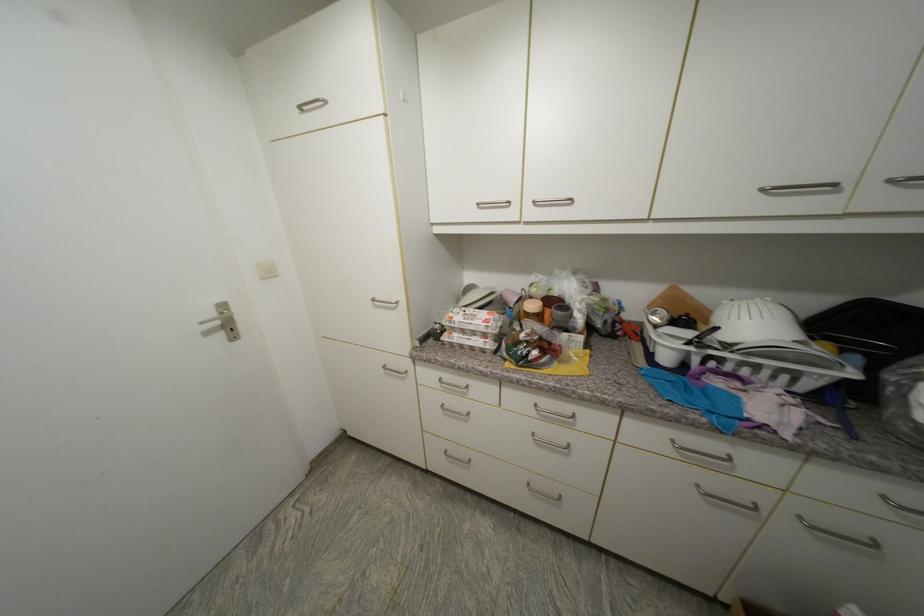
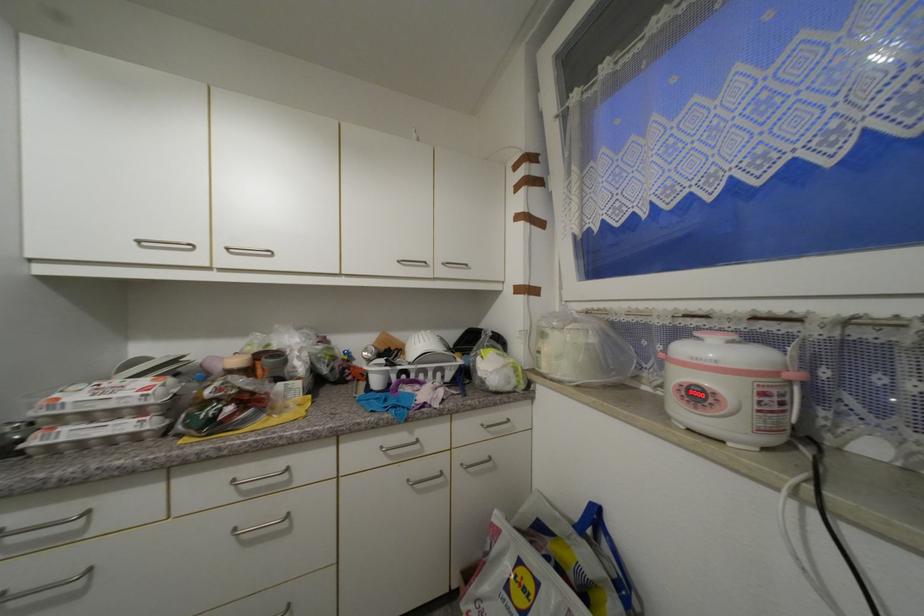
Where in the second image is the point corresponding to point (678, 443) from the first image?

(387, 448)